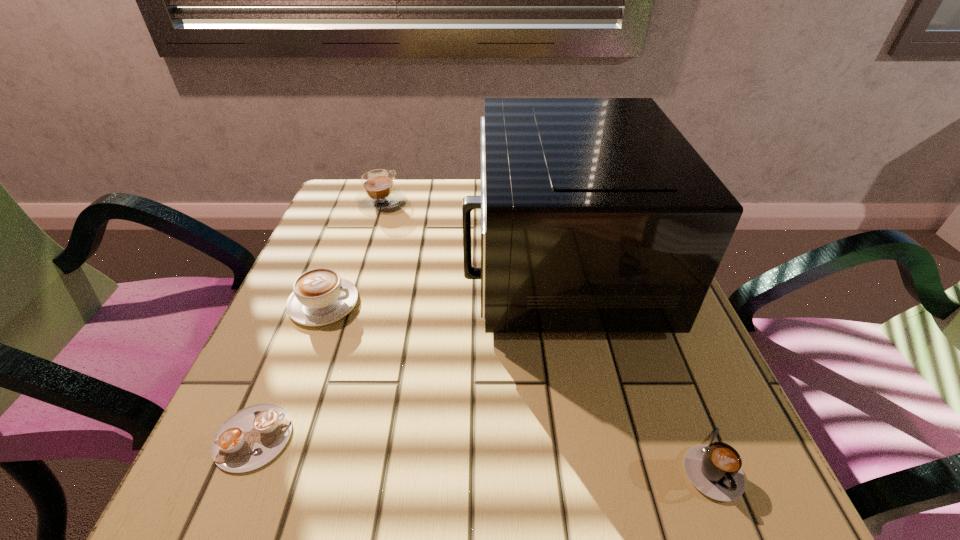
The width and height of the screenshot is (960, 540). Find the location of `the tallest object`. the tallest object is located at coordinates (597, 215).

You are a GUI agent. You are given a task and a screenshot of the screen. Output one action in this format:
    pyautogui.click(x=<x>, y=<y>)
    Task: Click on the farthest cappuccino
    
    Given the screenshot: What is the action you would take?
    pyautogui.click(x=379, y=193)

The image size is (960, 540). Find the location of `the tallest cappuccino`. the tallest cappuccino is located at coordinates (379, 193).

The image size is (960, 540). Identify the location of the third nearest cappuccino. [x=320, y=297].

Where is `the second tallest cappuccino`? Image resolution: width=960 pixels, height=540 pixels. the second tallest cappuccino is located at coordinates point(320,297).

Find the location of a particular element. This screenshot has height=540, width=960. the second shortest object is located at coordinates (715, 470).

Find the location of a particular element. the rightmost cappuccino is located at coordinates (715, 470).

In order to click on the shortest object in this screenshot , I will do `click(252, 437)`.

Find the location of a particular element. Image resolution: width=960 pixels, height=540 pixels. free space located 0.200m on the front-facing side of the microwave_oven is located at coordinates 372,262.

The width and height of the screenshot is (960, 540). Find the location of `free region located on the front-facing side of the microwave_oven`. free region located on the front-facing side of the microwave_oven is located at coordinates (429, 262).